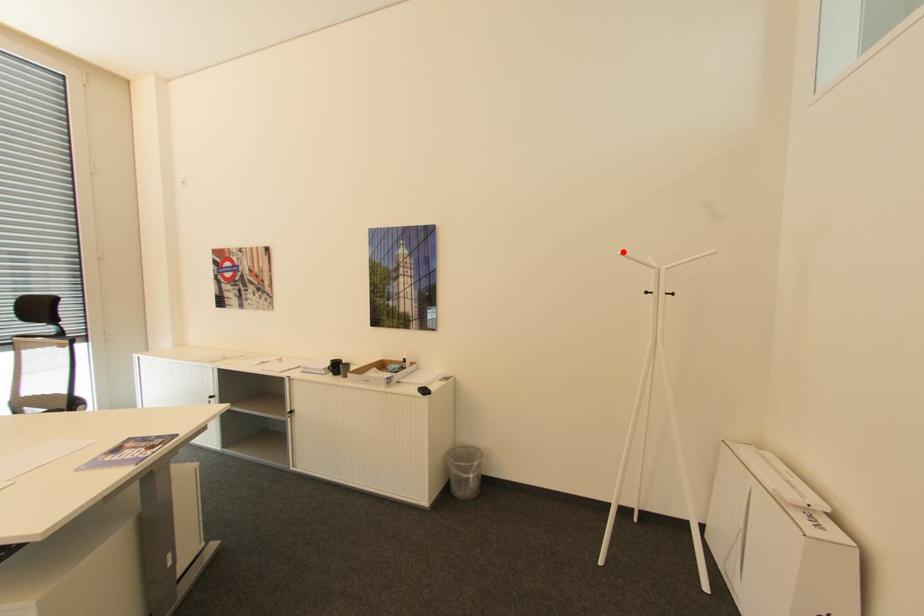
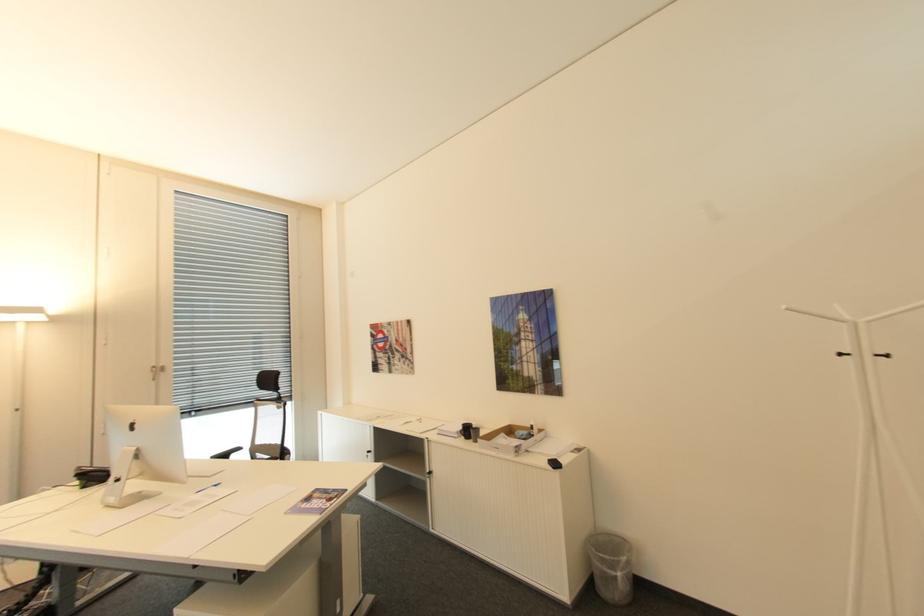
In the second image, find the point that corresponds to the highlighted location in the first image.

(791, 307)